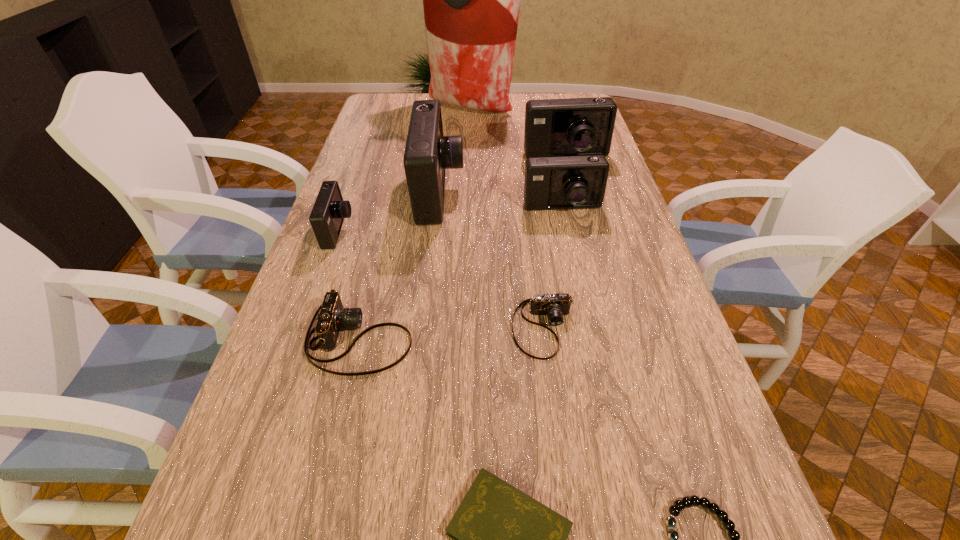
You are a GUI agent. You are given a task and a screenshot of the screen. Output one action in this format:
    pyautogui.click(x=<x>, y=<y>)
    Task: Click on the fourth shortest object
    This screenshot has height=540, width=960.
    Given the screenshot: What is the action you would take?
    pyautogui.click(x=333, y=317)

What are the coordinates of `the bigger brown camera` in the screenshot? It's located at (333, 317).

I want to click on the right brown camera, so pyautogui.click(x=556, y=305).

Locate an element on the screen. The width and height of the screenshot is (960, 540). the smaller brown camera is located at coordinates (556, 305).

This screenshot has width=960, height=540. Identify the location of vacant space located 0.080m on the right of the grocery bag. (533, 108).

This screenshot has width=960, height=540. Identify the location of vacant position located on the front-facing side of the biggest blue camera. (576, 194).

In order to click on free region located on the front-facing side of the second biggest blue camera in this screenshot , I will do `click(574, 192)`.

Identify the location of vacant region located on the front-facing side of the sixth shortest object. This screenshot has width=960, height=540. pyautogui.click(x=584, y=305).

The width and height of the screenshot is (960, 540). What are the coordinates of `vacant space located on the front-facing side of the third shortest camera` in the screenshot? It's located at (491, 231).

Locate an element on the screen. This screenshot has width=960, height=540. free space located on the front-facing side of the fourth shortest object is located at coordinates (447, 339).